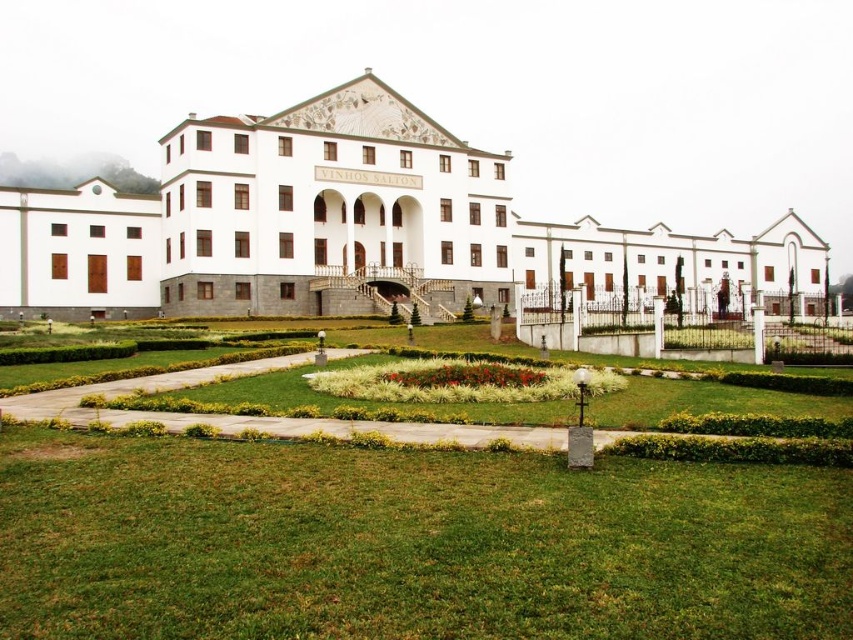
You are a landscape architect designing a new garden for the property. The client wants to ensure that the green grass at center and the white stone building at center are proportionate in their visual impact. Based on their current heights, which element should you consider adjusting to achieve this balance?

The green grass at center is shorter than the white stone building at center. To balance their visual impact, you should consider raising the height of the green grass at center or lowering the white stone building at center.

You are standing at the entrance of the grand building and want to walk towards the green grass at center. Which direction should you head?

You should head forward towards the green grass at center since it is located directly in front of the building at point (409, 544).

You are a landscape architect designing a pathway between the green grass at center and the white stone building at center. Which area requires a narrower pathway due to its smaller size?

The green grass at center has a lesser width compared to the white stone building at center, so the pathway near the green grass at center should be narrower to accommodate its smaller size.